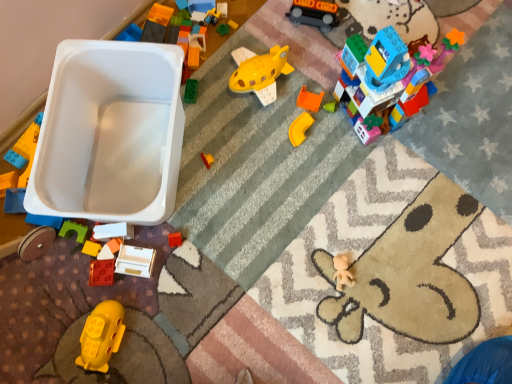
Where is `free space that is to the left of shiny black train at upper center, which ranks as the 2th toy in right-to-left order`? This screenshot has height=384, width=512. free space that is to the left of shiny black train at upper center, which ranks as the 2th toy in right-to-left order is located at coordinates tap(263, 39).